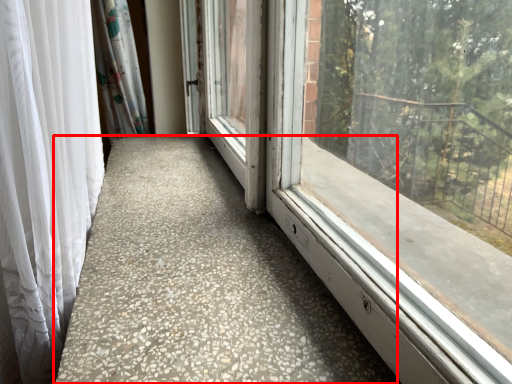
Question: Where is concrete (annotated by the red box) located in relation to curtain in the image?

Choices:
 (A) left
 (B) right

Answer: (B)